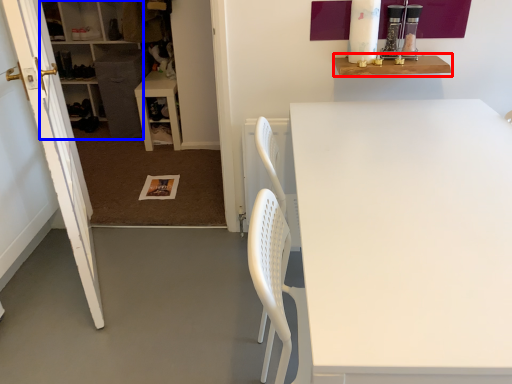
Question: Which point is closer to the camera, shelf (highlighted by a red box) or cabinetry (highlighted by a blue box)?

Choices:
 (A) shelf
 (B) cabinetry

Answer: (A)